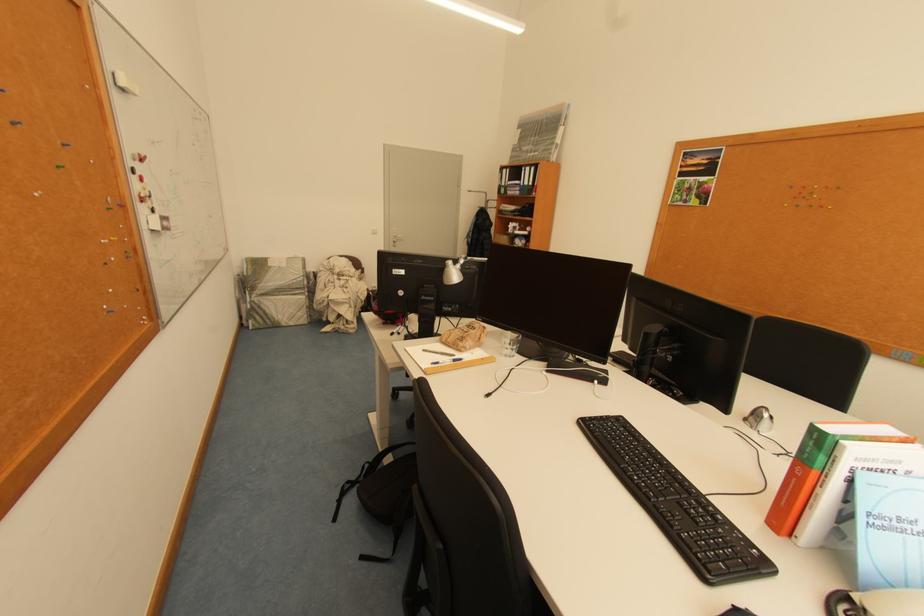
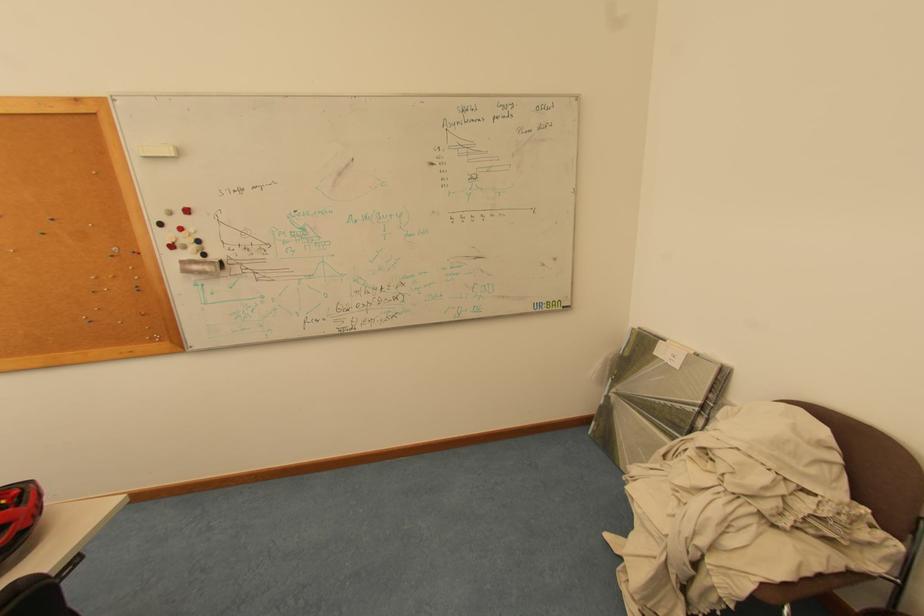
Find the pixel in the second image that matches pixel 262 297 in the first image.

(622, 392)